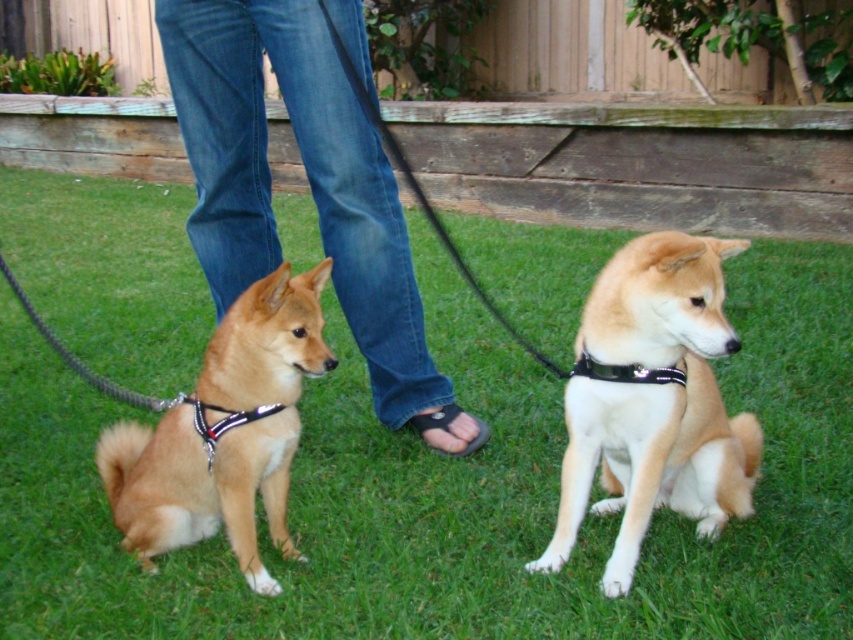
You are a dog owner who wants to know if your Shiba Inu with light brown fur at right can comfortably lie down on the green grass at lower center without its fur touching the ground. Based on the scene, can it?

The green grass at lower center is shorter than the light brown fur at right, so the dog can lie down comfortably without its fur touching the ground.

You are a dog trainer who needs to ensure the dogs are spaced safely apart. Given that the minimum required distance between two dogs is 36 inches, can you confirm if the light brown fur at right and golden fur dog at left are within the safety guidelines?

The distance between light brown fur at right and golden fur dog at left is 37.23 inches, which exceeds the minimum required 36 inches, so they are within the safety guidelines.